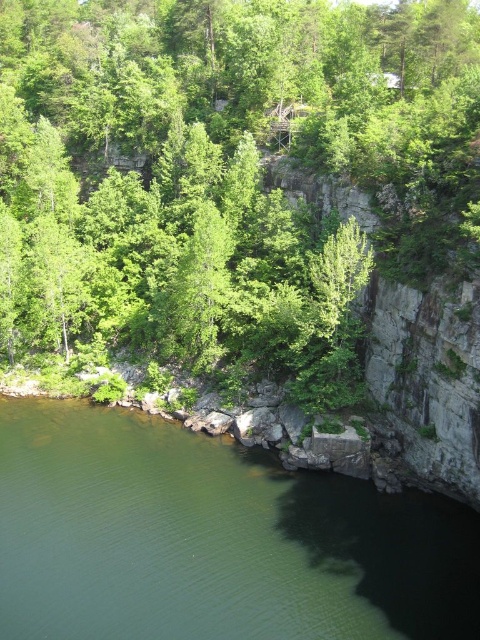
Consider the image. Who is more forward, (x=210, y=307) or (x=9, y=417)?

Point (x=9, y=417) is in front.

Is green leafy tree at upper center smaller than green smooth water at lower left?

Actually, green leafy tree at upper center might be larger than green smooth water at lower left.

Which is behind, point (110, 84) or point (0, 621)?

Point (110, 84)

At what (x,y) coordinates should I click in order to perform the action: click on green leafy tree at upper center. Please return your answer as a coordinate pair (x, y). Looking at the image, I should click on (228, 176).